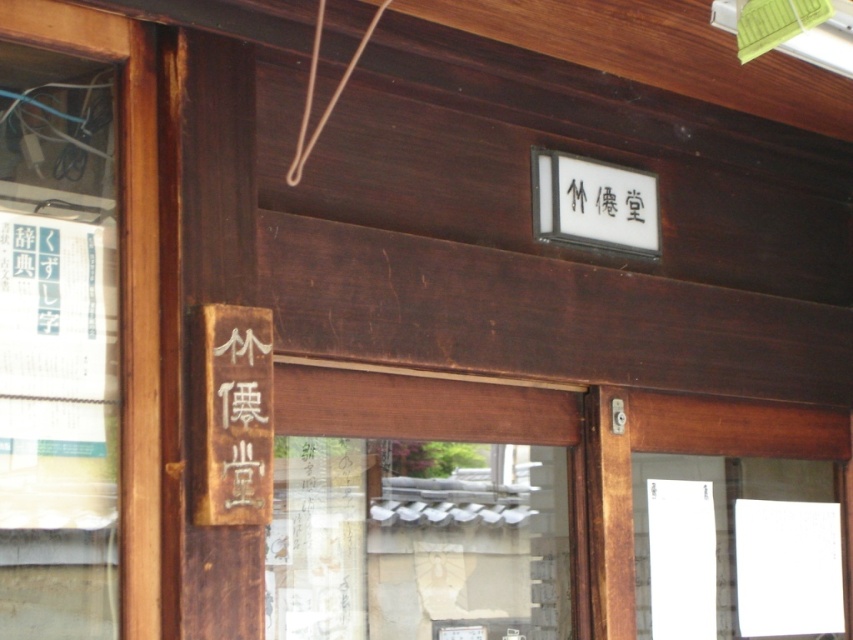
You are standing in front of a traditional Japanese building and notice two signs. One is the wooden sign at left and the other is the black wood sign at upper center. Which one is positioned to the left of the other?

The wooden sign at left is positioned to the left of the black wood sign at upper center.

You are standing in front of a traditional Japanese building and see the wooden door at center and the black wood sign at upper center. Which object is located above the other?

The black wood sign at upper center is located above the wooden door at center because the wooden door at center is positioned under it.

You are a visitor approaching the wooden door at center. There is also a wooden sign at left. Which object is bigger in size?

The wooden door at center has a larger size compared to wooden sign at left, so the wooden door at center is bigger.